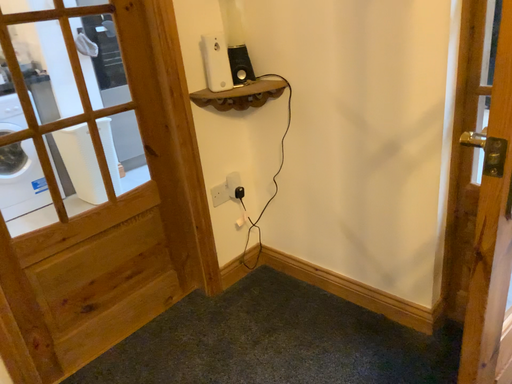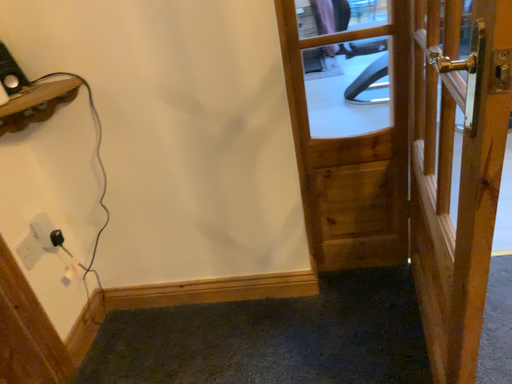
Question: How did the camera likely rotate when shooting the video?

Choices:
 (A) rotated right
 (B) rotated left

Answer: (A)